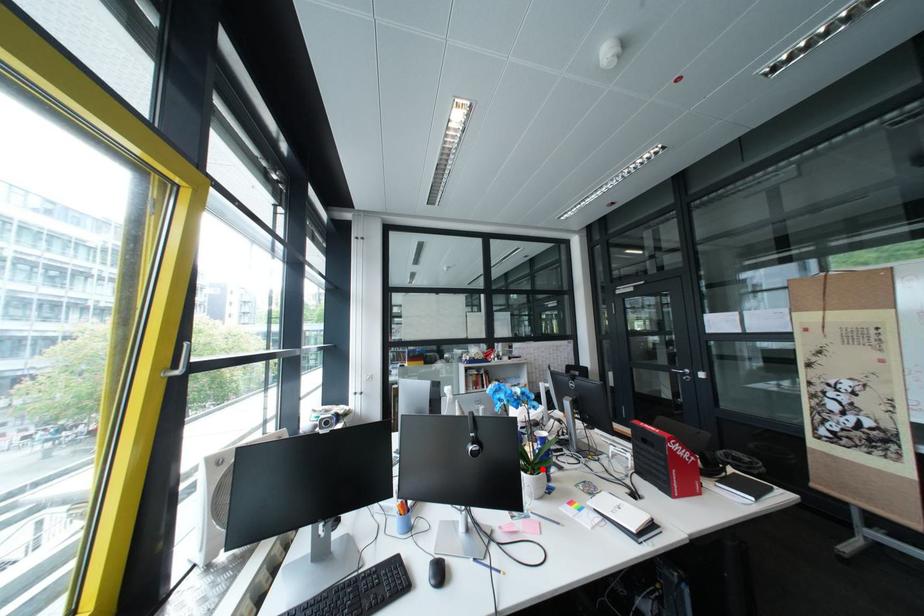
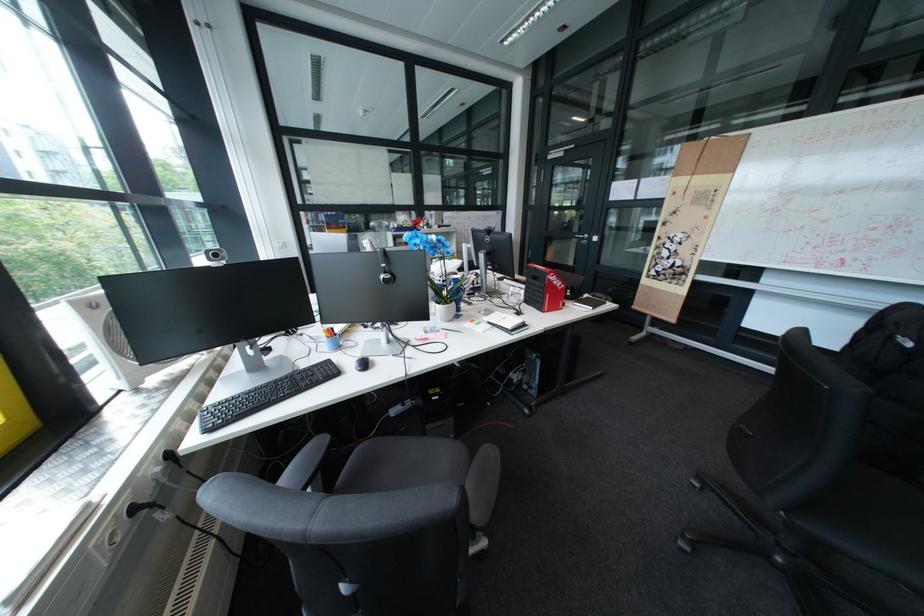
Question: I am providing you with two images of the same scene from different viewpoints. Given a red point in image1, look at the same physical point in image2. Is it:

Choices:
 (A) Closer to the viewpoint
 (B) Farther from the viewpoint

Answer: (B)